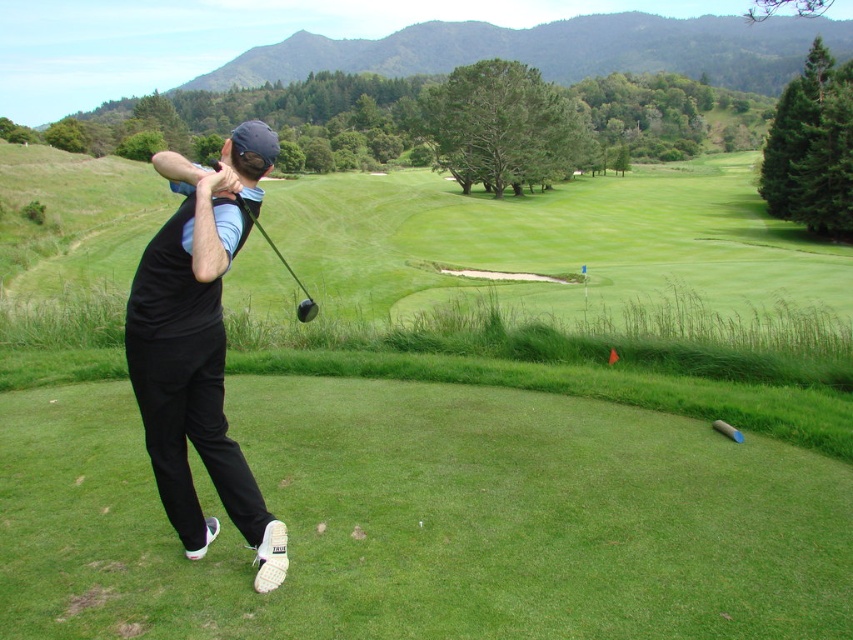
You are a golfer standing at point A, which is at coordinates point (135, 298). You want to hit the ball to point B, located at point (283, 260). Considering the golfer in the image is positioned on the left side of the frame, which direction should you aim relative to the golfer?

Point (135, 298) is in front of point (283, 260), so you should aim behind the golfer to hit the ball from point A to point B.